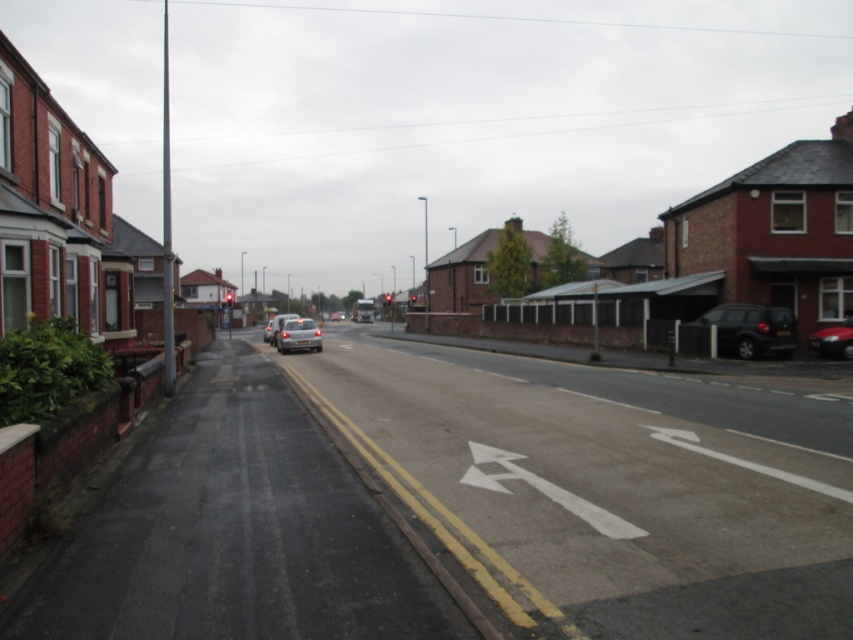
You are driving a delivery van and need to make a U turn on the smooth asphalt road at center. Considering the road width, can your white matte van at center fit comfortably for a U turn?

The smooth asphalt road at center has a lesser width compared to white matte van at center, so it may not provide enough space for a comfortable U turn. It is advisable to find a wider road segment or alternative route.